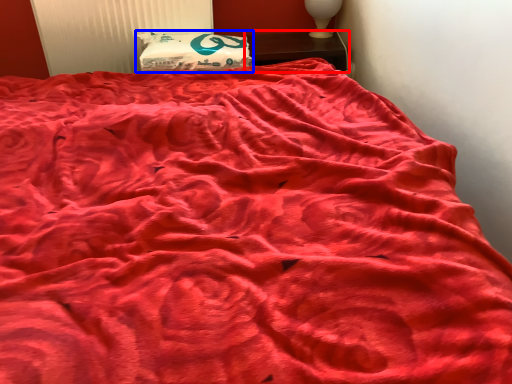
Question: Which object appears closest to the camera in this image, furniture (highlighted by a red box) or pillow (highlighted by a blue box)?

Choices:
 (A) furniture
 (B) pillow

Answer: (B)